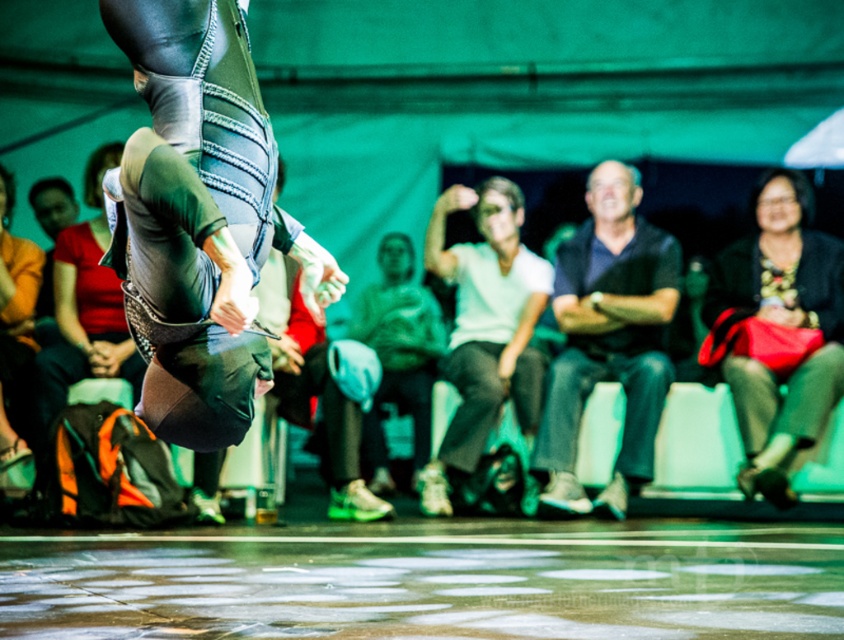
You are designing a seating arrangement for a small event and need to place two chairs. The chairs must accommodate the dark blue shirt at center and the matte black sweater at right. Given their sizes, which chair should be wider?

The dark blue shirt at center is larger in size than the matte black sweater at right, so the chair for the dark blue shirt at center should be wider to accommodate its size.

You are a photographer trying to capture the performer in the center of the image. You notice a point at coordinates (x=609, y=339). What object is located at this point?

The point at coordinates (x=609, y=339) is on the dark blue shirt at center.

What are the coordinates of the dark blue shirt at center?

The dark blue shirt at center is located at coordinates point (609,339).